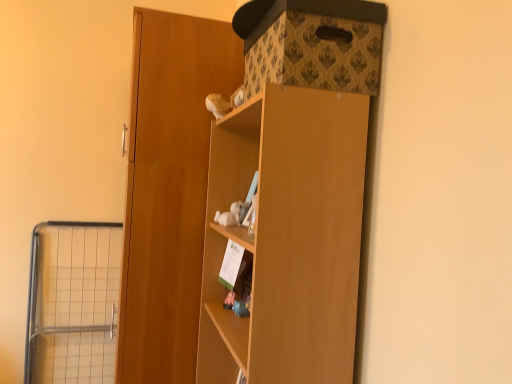
Question: Is metal wire cage at left taller or shorter than wooden cupboard at center?

Choices:
 (A) short
 (B) tall

Answer: (A)

Question: Is metal wire cage at left wider or thinner than wooden cupboard at center?

Choices:
 (A) wide
 (B) thin

Answer: (B)

Question: Estimate the real-world distances between objects in this image. Which object is closer to the patterned cardboard storage box at upper right?

Choices:
 (A) wooden door at center
 (B) wooden cupboard at center
 (C) metal wire cage at left

Answer: (B)

Question: Which is farther from the patterned cardboard storage box at upper right?

Choices:
 (A) wooden cupboard at center
 (B) wooden door at center
 (C) metal wire cage at left

Answer: (C)